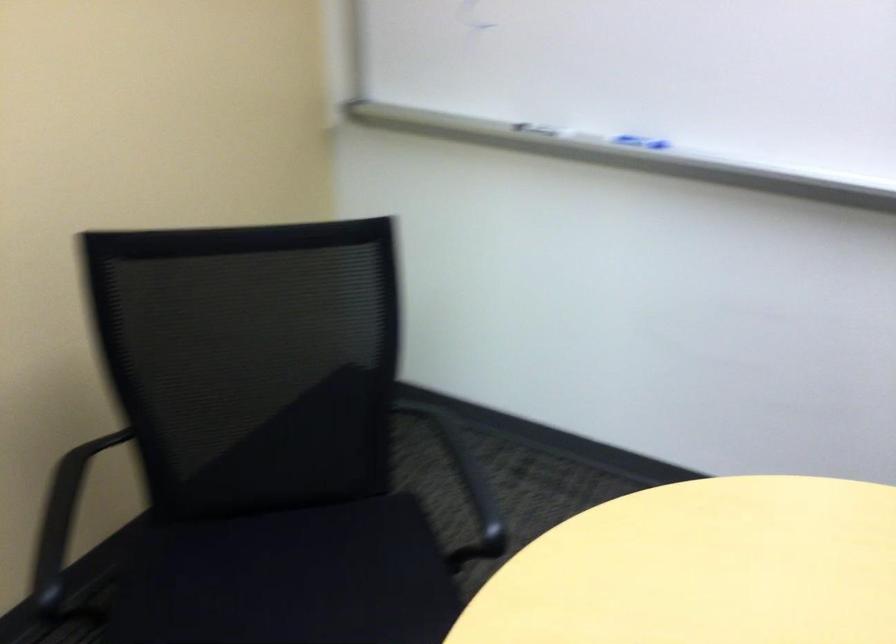
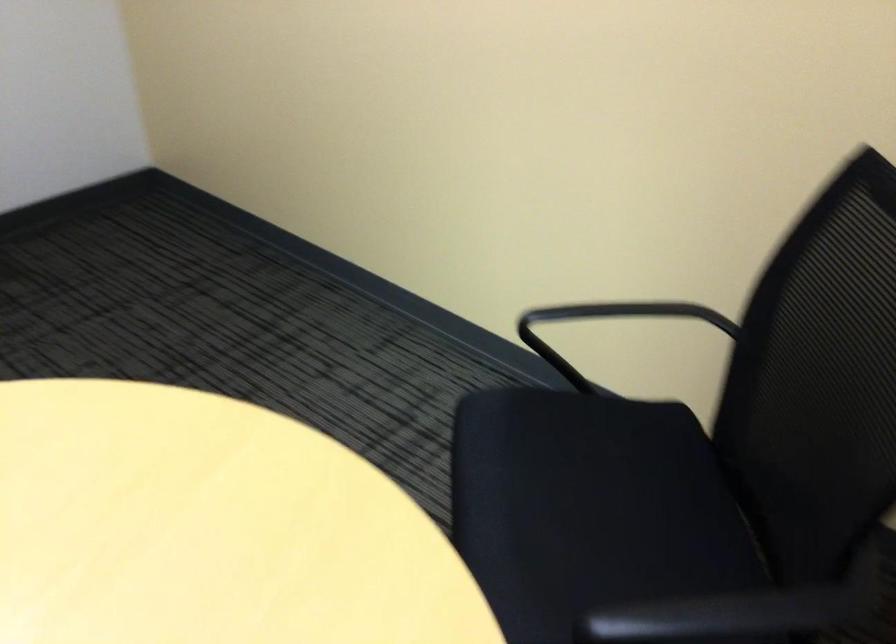
Based on the continuous images, in which direction is the camera rotating?

The camera rotated toward left-down.